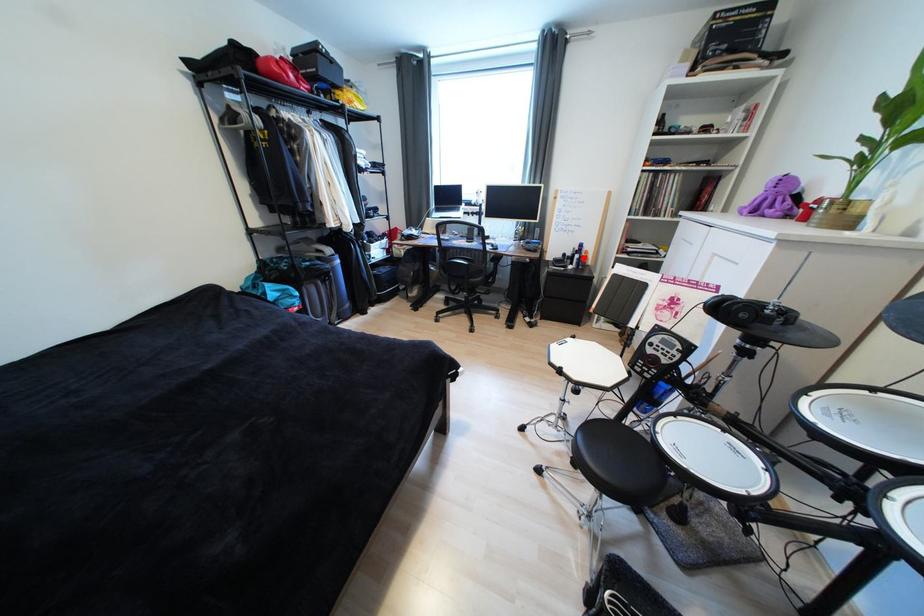
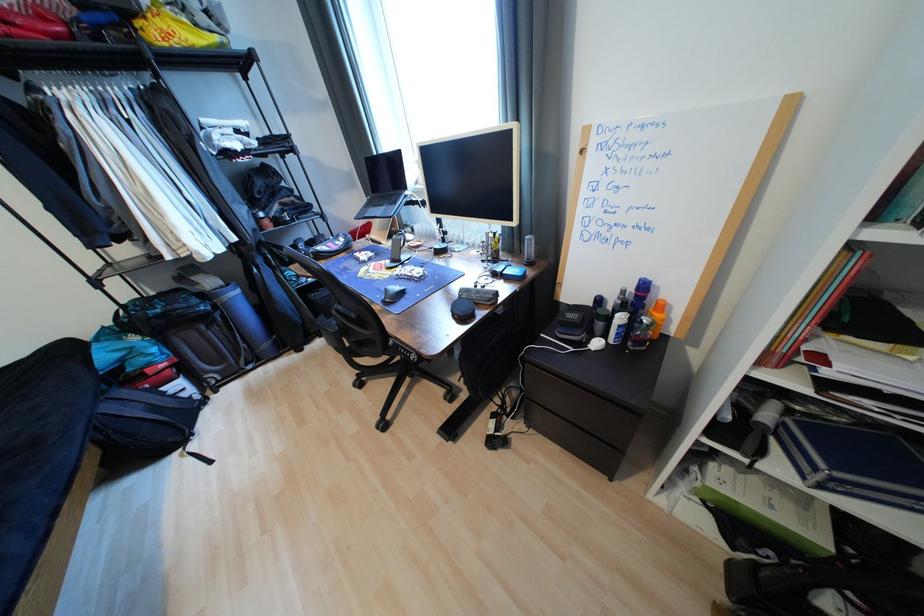
Question: I am providing you with two images of the same scene from different viewpoints. A red point is marked on the first image. At the location where the point appears in image 1, is it still visible in image 2?

Choices:
 (A) Yes
 (B) No

Answer: (A)